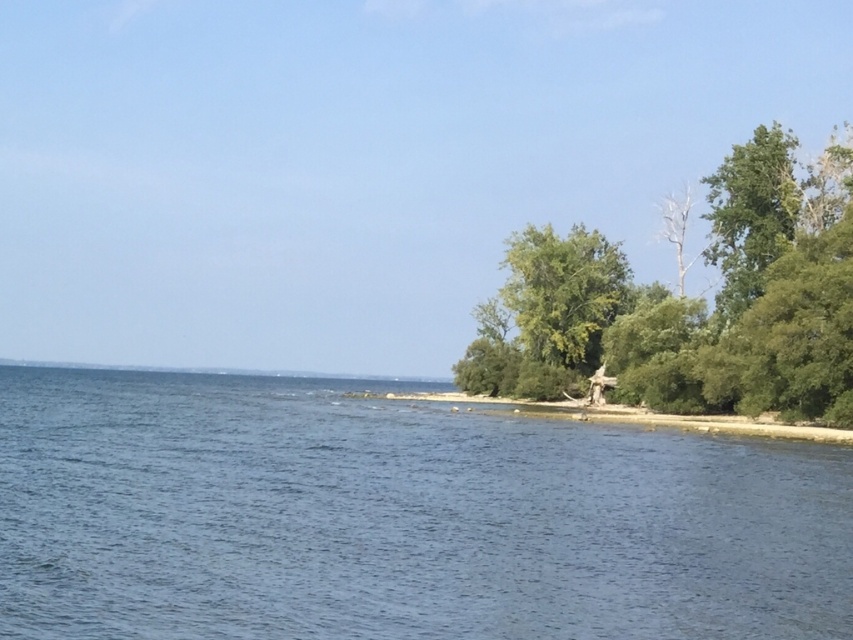
You are standing on the beach looking at the blue water at center and the green leafy tree at right. Which object is closer to your right side?

The green leafy tree at right is closer to your right side because it is positioned to the right of the blue water at center.

You are standing at the origin point of the coordinate system in the coastal scene. The blue water at center is at point (397,518). If you want to walk directly towards the blue water at center, which direction should you head?

To reach the blue water at center located at point (397,518) from the origin, you should head in the direction of the coordinates provided.

You are standing on the shore looking at the scene. Which object is closer to you between the blue water at center and the green leafy vegetation at lower right?

The blue water at center is closer to the viewer than the green leafy vegetation at lower right.